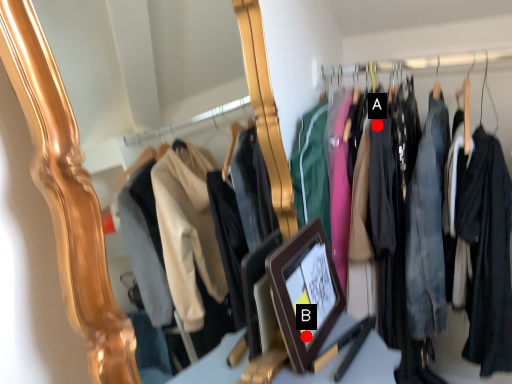
Question: Two points are circled on the image, labeled by A and B beside each circle. Which point is farther from the camera taking this photo?

Choices:
 (A) A is further
 (B) B is further

Answer: (A)